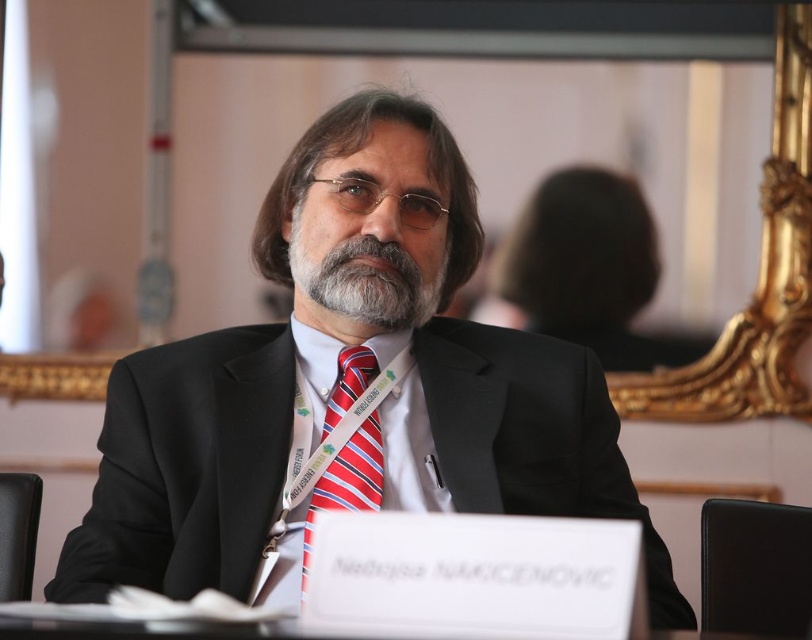
Question: Which object is the closest to the gray matte beard at center?

Choices:
 (A) black suit at center
 (B) white satin dress shirt at center
 (C) striped fabric tie at center

Answer: (B)

Question: Where is black suit at center located in relation to gray matte beard at center in the image?

Choices:
 (A) left
 (B) right

Answer: (B)

Question: Which point is closer to the camera taking this photo?

Choices:
 (A) (400, 406)
 (B) (391, 257)
 (C) (305, 538)

Answer: (C)

Question: Estimate the real-world distances between objects in this image. Which object is closer to the black suit at center?

Choices:
 (A) gray matte beard at center
 (B) white satin dress shirt at center
 (C) striped fabric tie at center

Answer: (B)

Question: Is white satin dress shirt at center smaller than striped fabric tie at center?

Choices:
 (A) no
 (B) yes

Answer: (A)

Question: Does black suit at center appear on the right side of striped fabric tie at center?

Choices:
 (A) yes
 (B) no

Answer: (A)